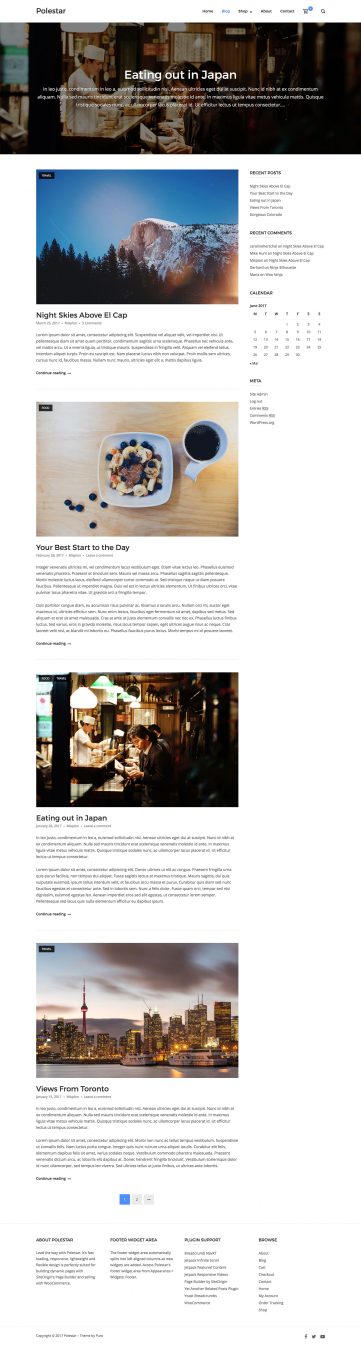
In order to click on lights in this screenshot , I will do `click(211, 1036)`, `click(149, 1025)`, `click(128, 1040)`, `click(73, 1039)`, `click(81, 696)`, `click(115, 688)`, `click(100, 27)`.